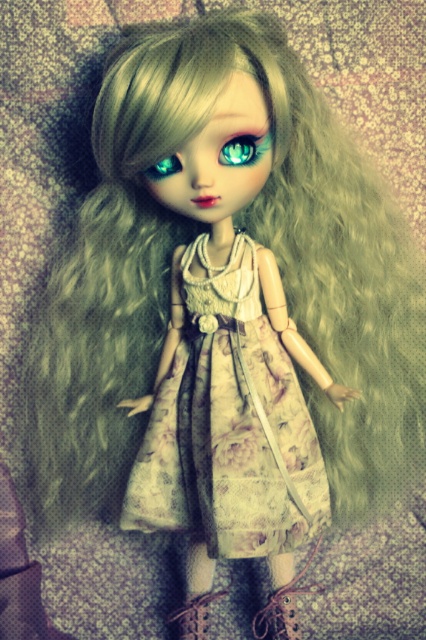
You are a repair technician who needs to reach the teal glass eye at upper left from your current position near the leather boot at lower center. The minimum distance you can move is 75 centimeters. Can you safely reach the teal glass eye at upper center without moving?

The leather boot at lower center is 73.81 centimeters away from the teal glass eye at upper left, which is less than the minimum required distance of 75 centimeters. Therefore, you cannot safely reach the teal glass eye at upper left without moving.

You are a fashion designer examining the doll and want to place a new accessory on the point marked as point [195,614]. What is the current item located at that position?

The point [195,614] indicates the location of the leather boot at lower center.